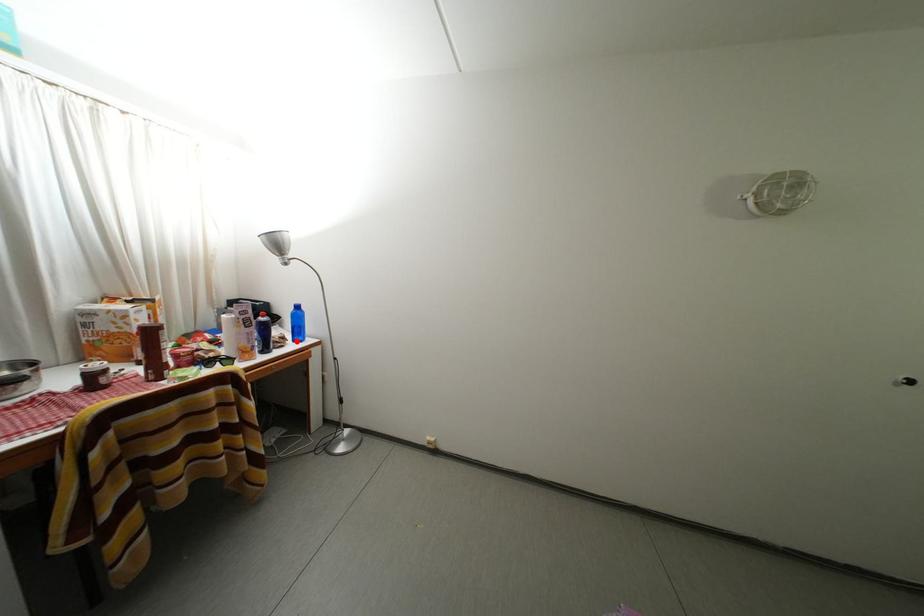
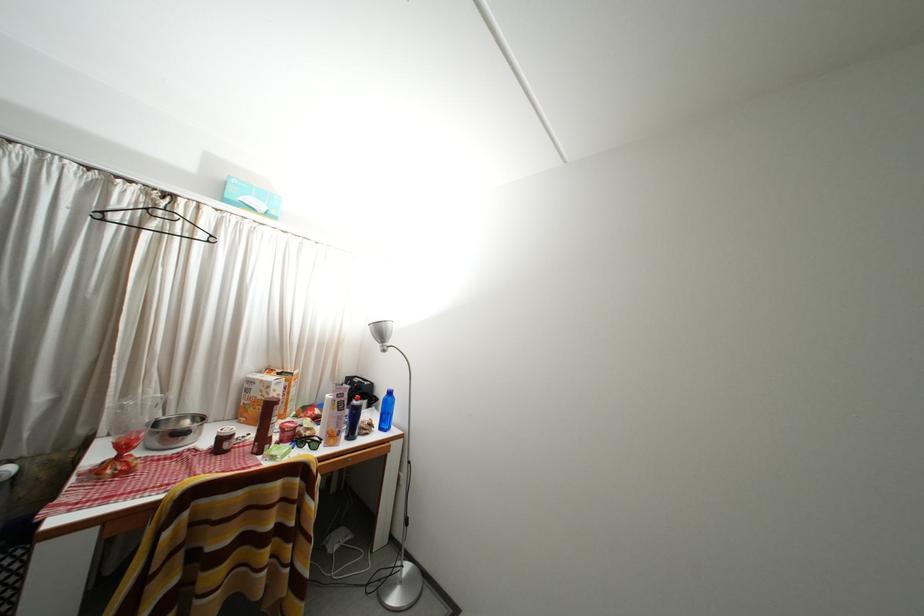
Find the pixel in the second image that matches the highlighted location in the first image.

(383, 428)